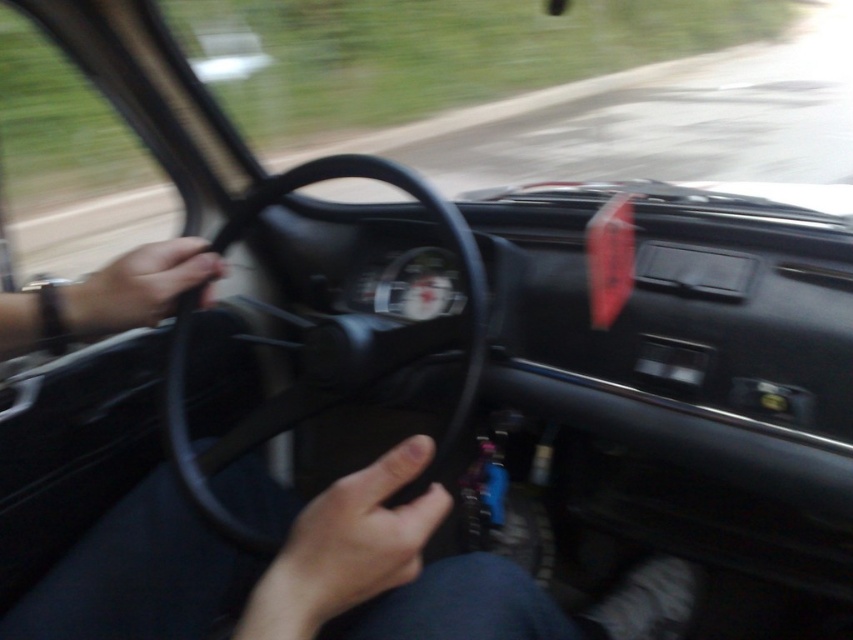
Question: Which point appears closest to the camera in this image?

Choices:
 (A) (467, 316)
 (B) (262, 605)
 (C) (206, 273)

Answer: (B)

Question: Which object is positioned closest to the skinny flesh at center?

Choices:
 (A) black rubber steering wheel at center
 (B) matte black steering wheel at left

Answer: (A)

Question: Considering the relative positions of black rubber steering wheel at center and matte black steering wheel at left in the image provided, where is black rubber steering wheel at center located with respect to matte black steering wheel at left?

Choices:
 (A) left
 (B) right

Answer: (B)

Question: Can you confirm if skinny flesh at center is positioned to the right of matte black steering wheel at left?

Choices:
 (A) no
 (B) yes

Answer: (B)

Question: Does black rubber steering wheel at center appear on the right side of skinny flesh at center?

Choices:
 (A) no
 (B) yes

Answer: (A)

Question: Estimate the real-world distances between objects in this image. Which object is closer to the black rubber steering wheel at center?

Choices:
 (A) skinny flesh at center
 (B) matte black steering wheel at left

Answer: (B)